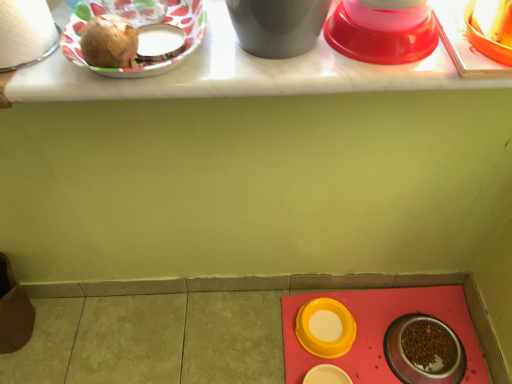
Question: Considering their positions, is white matte toilet paper at upper left located in front of or behind metallic silver bowl at lower right, marked as the first tableware in a right-to-left arrangement?

Choices:
 (A) behind
 (B) front

Answer: (B)

Question: Considering the relative positions of white matte toilet paper at upper left and metallic silver bowl at lower right, marked as the first tableware in a right-to-left arrangement, in the image provided, is white matte toilet paper at upper left to the left or to the right of metallic silver bowl at lower right, marked as the first tableware in a right-to-left arrangement,?

Choices:
 (A) right
 (B) left

Answer: (B)

Question: Estimate the real-world distances between objects in this image. Which object is farther from the shiny brown onion at upper left?

Choices:
 (A) yellow matte bowl at lower center, which is the second tableware from back to front
 (B) matte plastic plate at upper left, arranged as the sixth tableware when viewed from the right
 (C) matte white table at upper center
 (D) white matte toilet paper at upper left
 (E) shiny plastic bowl at upper right, which ranks as the fifth tableware in back-to-front order

Answer: (A)

Question: Estimate the real-world distances between objects in this image. Which object is farther from the metallic silver bowl at lower right, which ranks as the 5th tableware in top-to-bottom order?

Choices:
 (A) matte plastic plate at upper left, which appears as the third tableware when viewed from the top
 (B) matte plastic plate at upper left, placed as the 1th tableware when sorted from front to back
 (C) shiny brown onion at upper left
 (D) white matte toilet paper at upper left
 (E) yellow matte bowl at lower center, which is the third tableware from left to right

Answer: (D)